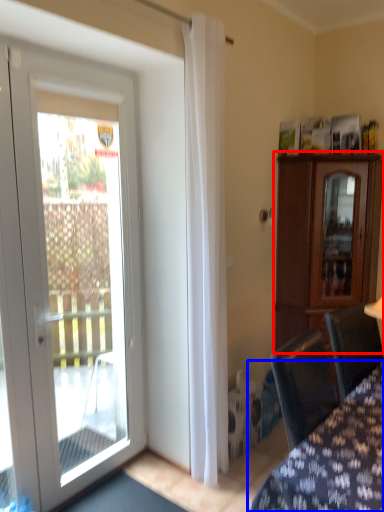
Question: Which object appears farthest to the camera in this image, cabinetry (highlighted by a red box) or furniture (highlighted by a blue box)?

Choices:
 (A) cabinetry
 (B) furniture

Answer: (A)